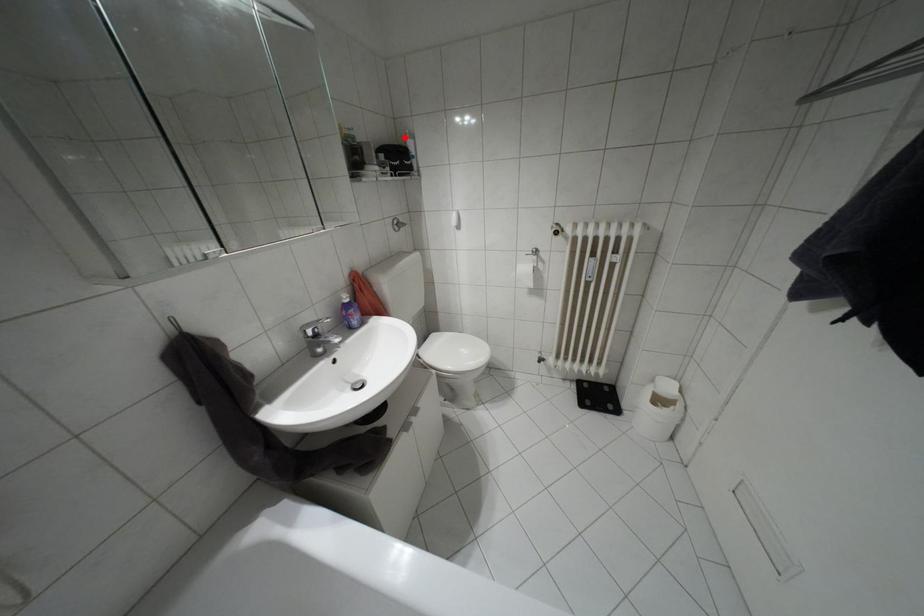
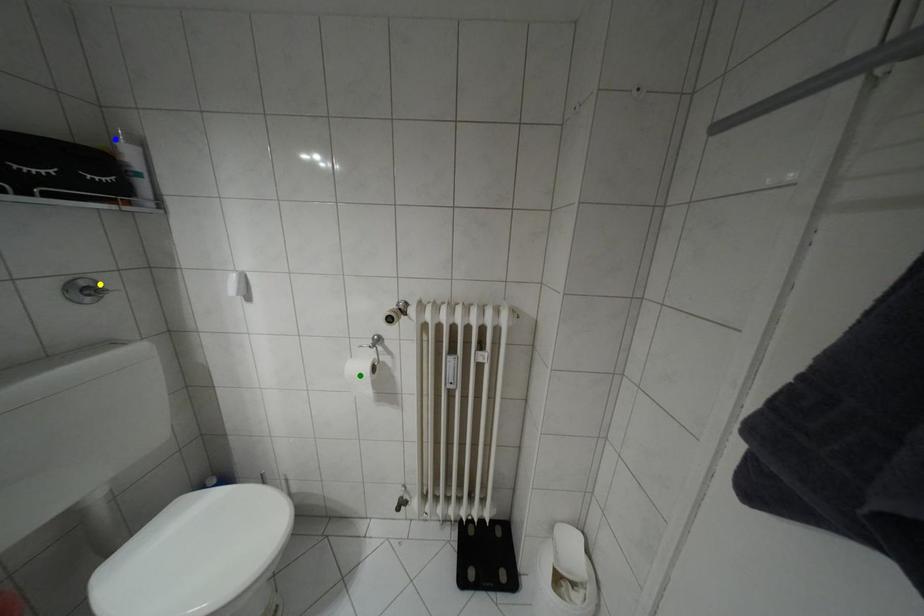
Question: I am providing you with two images of the same scene from different viewpoints. A red point is marked on the first image. You are given multiple points on the second image. In image 2, which mark is for the same physical point as the one in image 1?

Choices:
 (A) blue point
 (B) green point
 (C) yellow point

Answer: (A)